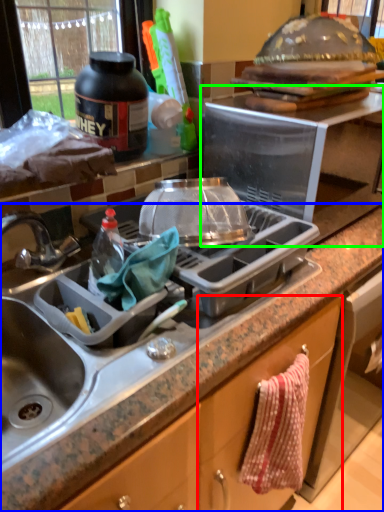
Question: Based on their relative distances, which object is farther from cabinetry (highlighted by a red box)? Choose from countertop (highlighted by a blue box) and appliance (highlighted by a green box).

Choices:
 (A) countertop
 (B) appliance

Answer: (B)